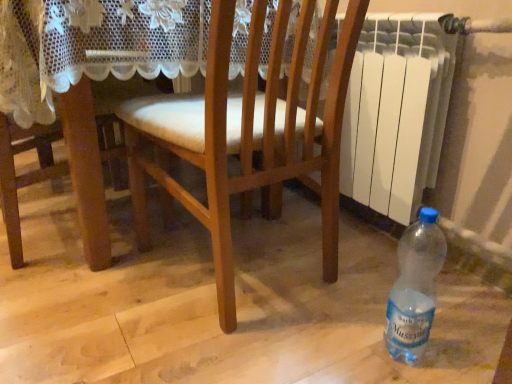
Question: Is wooden chair at center directly adjacent to translucent plastic bottle at lower right?

Choices:
 (A) no
 (B) yes

Answer: (A)

Question: Considering the relative sizes of wooden chair at center and translucent plastic bottle at lower right in the image provided, is wooden chair at center bigger than translucent plastic bottle at lower right?

Choices:
 (A) no
 (B) yes

Answer: (B)

Question: Is wooden chair at center facing away from translucent plastic bottle at lower right?

Choices:
 (A) yes
 (B) no

Answer: (A)

Question: Is wooden chair at center aimed at translucent plastic bottle at lower right?

Choices:
 (A) yes
 (B) no

Answer: (B)

Question: From a real-world perspective, is wooden chair at center located higher than translucent plastic bottle at lower right?

Choices:
 (A) yes
 (B) no

Answer: (A)

Question: Considering the relative positions of wooden chair at center and translucent plastic bottle at lower right in the image provided, is wooden chair at center behind translucent plastic bottle at lower right?

Choices:
 (A) no
 (B) yes

Answer: (A)

Question: Is white plastic radiator at right closer to the viewer compared to translucent plastic bottle at lower right?

Choices:
 (A) yes
 (B) no

Answer: (B)

Question: Is white plastic radiator at right shorter than translucent plastic bottle at lower right?

Choices:
 (A) yes
 (B) no

Answer: (B)

Question: Is white plastic radiator at right facing away from translucent plastic bottle at lower right?

Choices:
 (A) yes
 (B) no

Answer: (B)

Question: Does white plastic radiator at right have a greater height compared to translucent plastic bottle at lower right?

Choices:
 (A) no
 (B) yes

Answer: (B)

Question: From the image's perspective, is white plastic radiator at right located beneath translucent plastic bottle at lower right?

Choices:
 (A) yes
 (B) no

Answer: (B)

Question: Is white plastic radiator at right at the left side of translucent plastic bottle at lower right?

Choices:
 (A) no
 (B) yes

Answer: (A)

Question: Does translucent plastic bottle at lower right have a greater width compared to wooden chair at center?

Choices:
 (A) yes
 (B) no

Answer: (B)